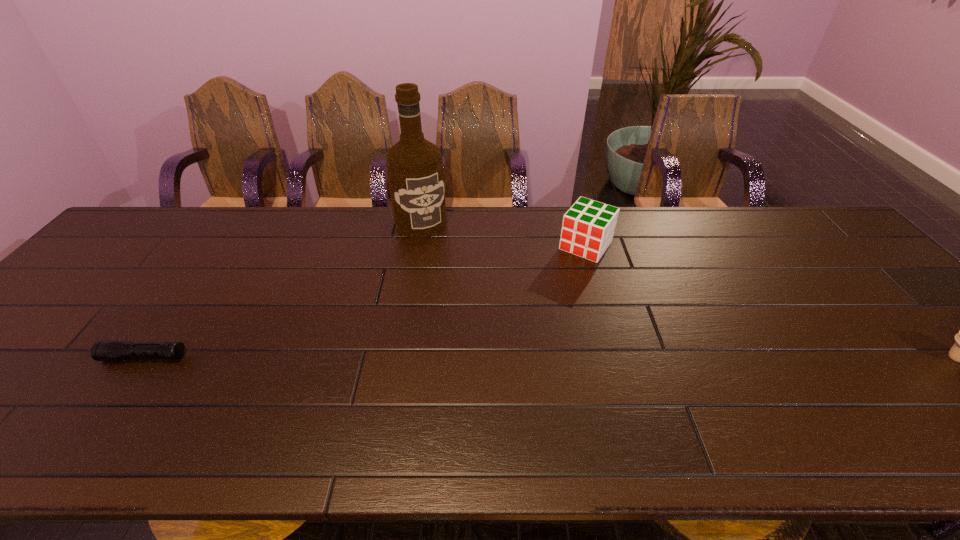
Find the location of a particular element. This screenshot has height=540, width=960. the shortest object is located at coordinates (101, 350).

At what (x,y) coordinates should I click in order to perform the action: click on the leftmost object. Please return your answer as a coordinate pair (x, y). This screenshot has height=540, width=960. Looking at the image, I should click on (101, 350).

Where is `alcohol`? alcohol is located at coordinates (414, 165).

Locate an element on the screen. the third object from right to left is located at coordinates (414, 165).

Find the location of a particular element. the third tallest object is located at coordinates (588, 227).

Locate an element on the screen. Image resolution: width=960 pixels, height=540 pixels. the third object from left to right is located at coordinates (588, 227).

The height and width of the screenshot is (540, 960). In order to click on vacant space located 0.050m at the lens end of the shortest object in this screenshot , I will do `click(83, 357)`.

Locate an element on the screen. This screenshot has width=960, height=540. vacant space located 0.050m at the lens end of the shortest object is located at coordinates (83, 357).

Find the location of a particular element. The height and width of the screenshot is (540, 960). vacant area located at the lens end of the shortest object is located at coordinates (53, 357).

At what (x,y) coordinates should I click in order to perform the action: click on free space located on the label of the tallest object. Please return your answer as a coordinate pair (x, y). Looking at the image, I should click on (453, 282).